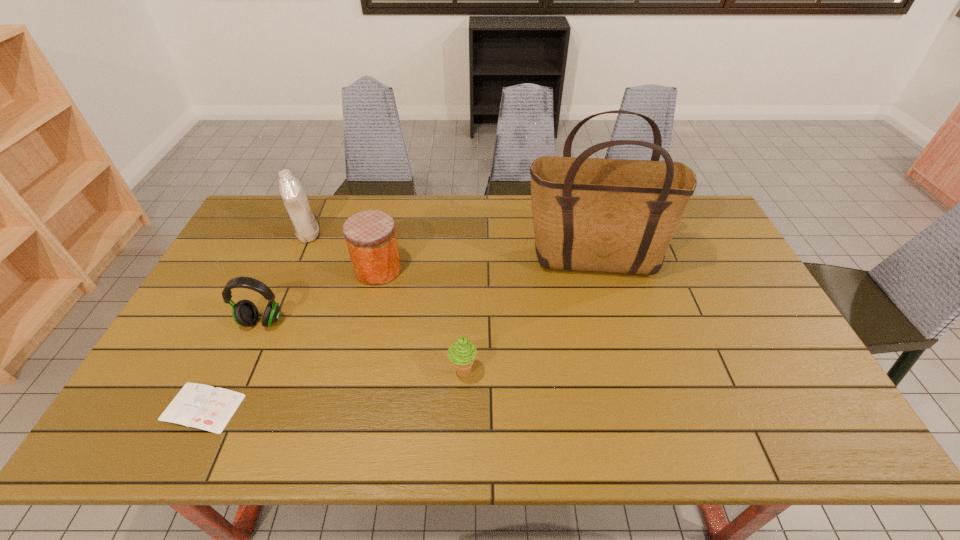
At what (x,y) coordinates should I click in order to perform the action: click on free area in between the jar and the diary. Please return your answer as a coordinate pair (x, y). Image resolution: width=960 pixels, height=540 pixels. Looking at the image, I should click on (291, 339).

Locate an element on the screen. the third closest object to the fifth shortest object is located at coordinates (205, 407).

Identify the location of object that is the fifth closest to the fifth shortest object. (591, 214).

Where is `vacant position in the image that satisfies the following two spatial constraints: 1. on the front side of the fourth object from left to right; 2. on the left side of the icecream`? The image size is (960, 540). vacant position in the image that satisfies the following two spatial constraints: 1. on the front side of the fourth object from left to right; 2. on the left side of the icecream is located at coordinates (354, 371).

This screenshot has height=540, width=960. Find the location of `vacant region that satisfies the following two spatial constraints: 1. on the ear cups of the icecream; 2. on the right side of the headset`. vacant region that satisfies the following two spatial constraints: 1. on the ear cups of the icecream; 2. on the right side of the headset is located at coordinates (240, 371).

This screenshot has height=540, width=960. Find the location of `vacant area that satisfies the following two spatial constraints: 1. on the back side of the detergent; 2. on the right side of the shortest object`. vacant area that satisfies the following two spatial constraints: 1. on the back side of the detergent; 2. on the right side of the shortest object is located at coordinates point(287,233).

Identify the location of free location that satisfies the following two spatial constraints: 1. on the back side of the icecream; 2. on the right side of the rightmost object. Image resolution: width=960 pixels, height=540 pixels. (467, 262).

Identify the location of blank space that satisfies the following two spatial constraints: 1. on the front side of the second tallest object; 2. on the right side of the fourth object from left to right. The image size is (960, 540). (293, 269).